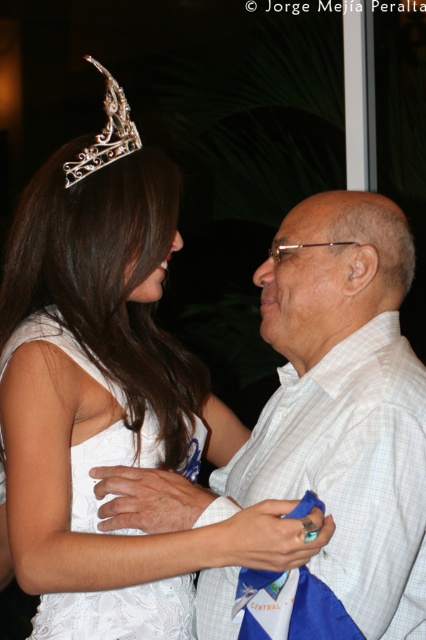
Question: Where is white checkered shirt at center located in relation to matte gold forehead at center in the image?

Choices:
 (A) above
 (B) below

Answer: (B)

Question: Can you confirm if white checkered shirt at center is smaller than white lace dress at center?

Choices:
 (A) no
 (B) yes

Answer: (A)

Question: Among these points, which one is farthest from the camera?

Choices:
 (A) 301,205
 (B) 123,104

Answer: (A)

Question: Which of the following is the farthest from the observer?

Choices:
 (A) matte gold forehead at center
 (B) white lace dress at center
 (C) white shirt at center
 (D) white checkered shirt at center

Answer: (A)

Question: Can you confirm if white lace dress at center is thinner than matte gold forehead at center?

Choices:
 (A) no
 (B) yes

Answer: (A)

Question: Which point is farther from the camera taking this photo?

Choices:
 (A) (273, 288)
 (B) (132, 136)
 (C) (68, 628)
 (D) (322, 264)

Answer: (A)